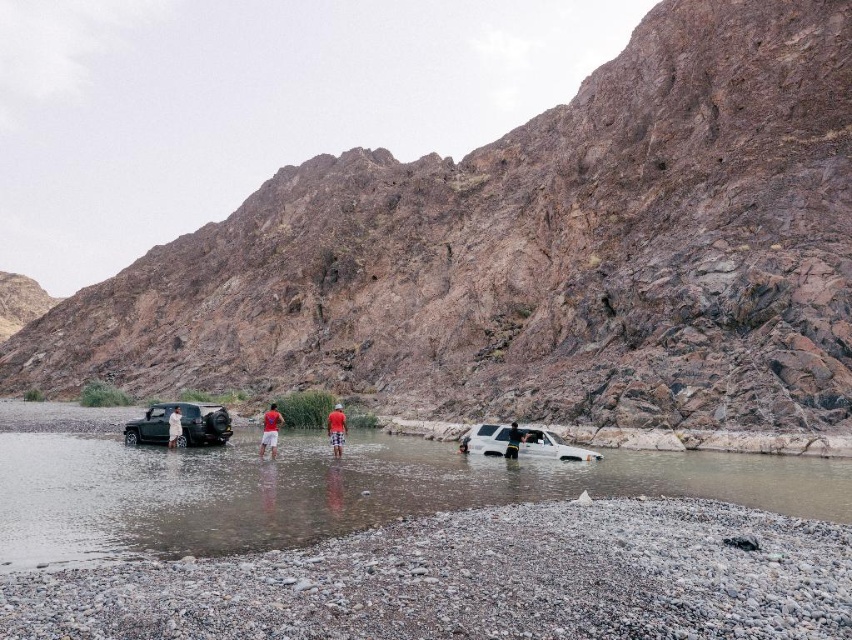
You are a photographer positioned at the camera location. You want to capture a clear photo of the red cotton shirt at center. Considering the distance, is it advisable to use a telephoto lens?

The red cotton shirt at center is 208.45 feet away from the camera. Using a telephoto lens would be advisable to capture a clear photo of the red cotton shirt at center from that distance.

You are standing at the point marked as point (551, 445) in the image. Which object are you currently standing on?

You are standing on the white matte suv at center.

You are a hiker trying to cross the river to reach the other side. You see a white matte suv at center and red plaid shorts at center. Which object is closer to you as you stand on the riverbank?

The white matte suv at center is closer to you than the red plaid shorts at center.